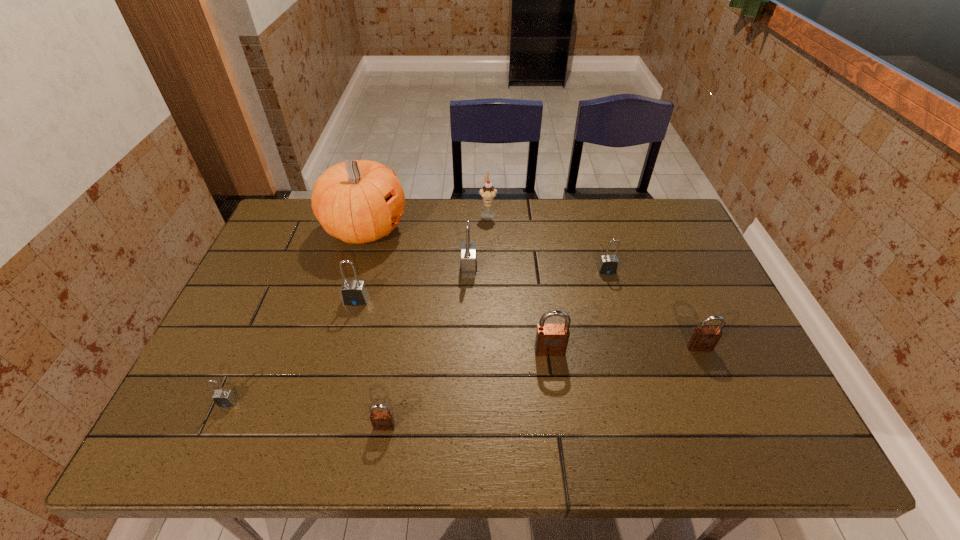
This screenshot has width=960, height=540. I want to click on free space located 0.160m on the shackle of the fifth nearest object, so pyautogui.click(x=342, y=355).

At what (x,y) coordinates should I click in order to perform the action: click on vacant space located on the front-facing side of the second brown padlock from right to left. Please return your answer as a coordinate pair (x, y). Looking at the image, I should click on (561, 429).

You are a GUI agent. You are given a task and a screenshot of the screen. Output one action in this format:
    pyautogui.click(x=<x>, y=<y>)
    Task: Click on the vacant position located 0.130m on the shackle of the third biggest gray padlock
    This screenshot has width=960, height=540.
    Given the screenshot: What is the action you would take?
    pyautogui.click(x=617, y=308)

Where is `free location located on the front-facing side of the rightmost object`? free location located on the front-facing side of the rightmost object is located at coordinates (729, 415).

Where is `vacant region located 0.060m on the shackle of the nearest gray padlock`? Image resolution: width=960 pixels, height=540 pixels. vacant region located 0.060m on the shackle of the nearest gray padlock is located at coordinates (214, 433).

The image size is (960, 540). Identify the location of pumpkin present at the far edge. (357, 201).

Where is `icecream that is at the far edge`? The width and height of the screenshot is (960, 540). icecream that is at the far edge is located at coordinates (488, 192).

The width and height of the screenshot is (960, 540). What are the coordinates of `object situated at the near edge` in the screenshot? It's located at (382, 420).

Find the location of `pumpkin present at the left edge`. pumpkin present at the left edge is located at coordinates (357, 201).

At what (x,y) coordinates should I click in order to perform the action: click on padlock present at the left edge. Please return your answer as a coordinate pair (x, y). Looking at the image, I should click on (223, 398).